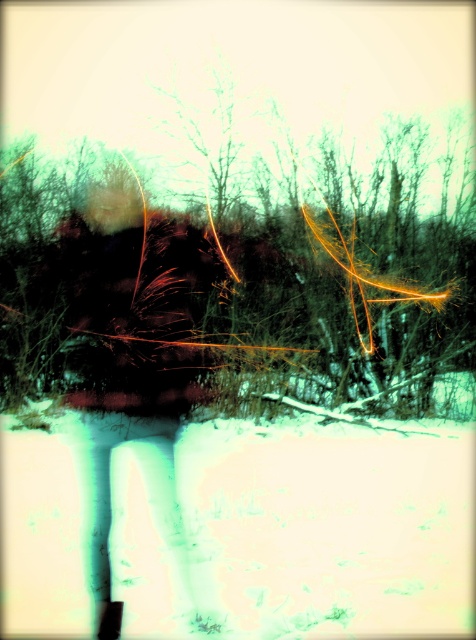
You are a photographer trying to capture the translucent plastic bag at center and the white powdery snow at lower center in a single frame. Based on their positions, which object is closer to the camera?

The white powdery snow at lower center is to the right of the translucent plastic bag at center, so the snow is closer to the camera than the bag.

You are a photographer trying to capture a clear shot of the point at coordinates [164,365] in the image. Given that the point is 3.22 meters away from the camera, what is the minimum focusing distance your camera lens must have to ensure sharpness?

The point at coordinates [164,365] is 3.22 meters away from the camera. To ensure sharpness, the camera lens must have a minimum focusing distance of 3.22 meters or less.